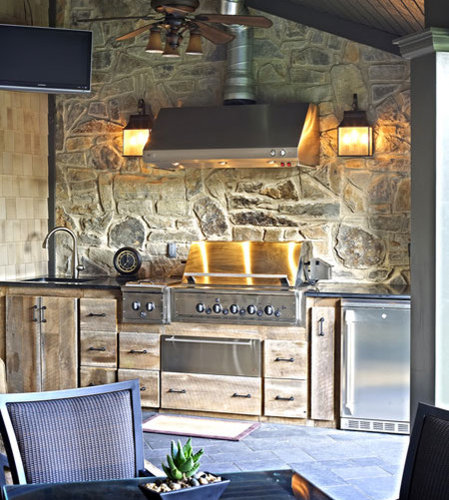
This screenshot has height=500, width=449. What are the coordinates of `chair` in the screenshot? It's located at (115, 482).